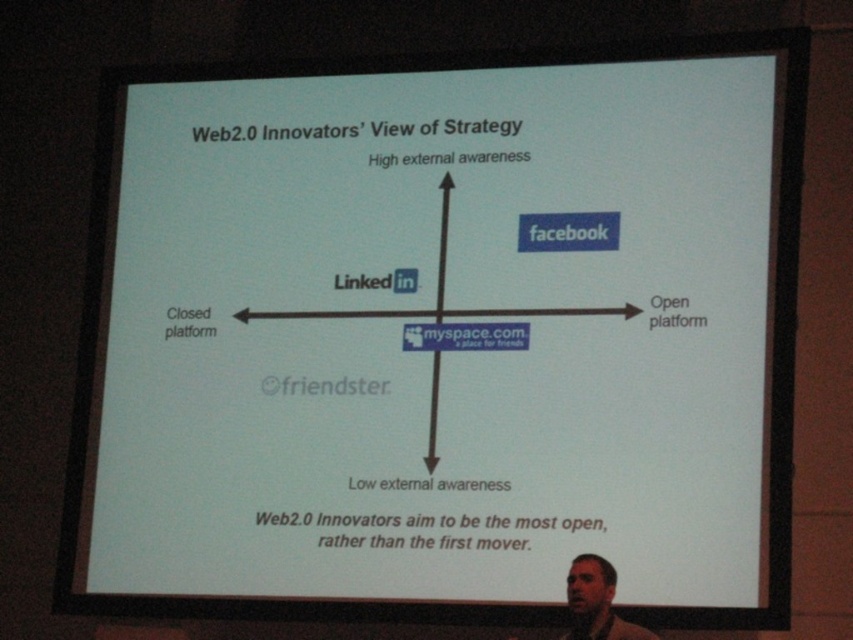
You are an attendee at a lecture and notice the light brown skin at lower right and the black arrow at center on the slide. Which object is positioned more to the east side of the slide?

The light brown skin at lower right is positioned to the east side of the slide because it is to the right of the black arrow at center, and in standard slide orientations, east would correspond to the right side.

You are an attendee at the lecture and you notice two elements on the slide. One is the light brown skin at lower right and the other is the black arrow at center. Which of these elements is taller?

The light brown skin at lower right is much taller than the black arrow at center according to the description.